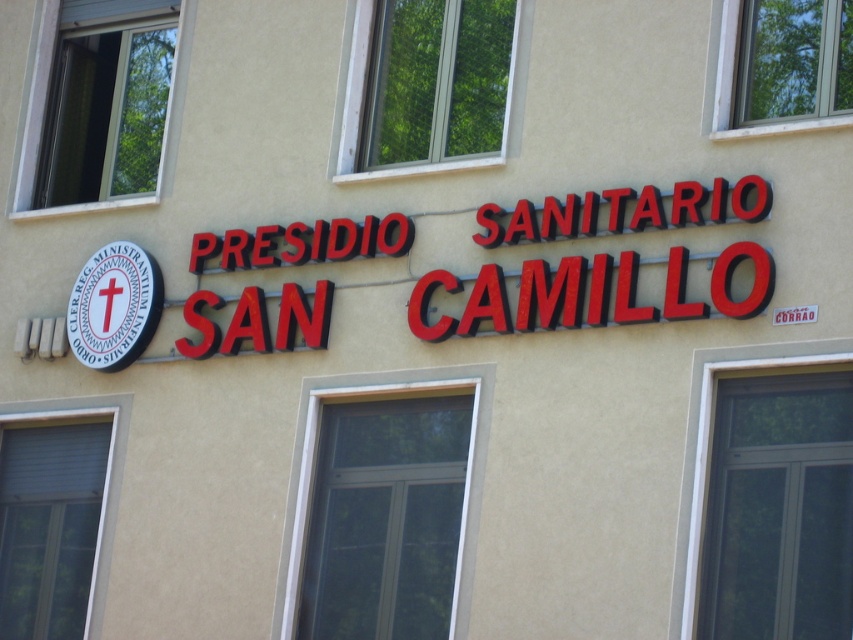
Looking at the building facade, you see a red plastic sign at center and a white matte circular sign at left. Which one is positioned more to the right side?

The red plastic sign at center is positioned to the right of the white matte circular sign at left, so it is more to the right side.